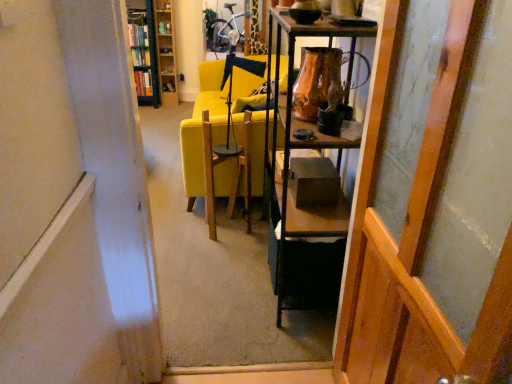
Question: Is the depth of yellow fabric couch at center less than that of wooden chair at center?

Choices:
 (A) yes
 (B) no

Answer: (B)

Question: Is wooden chair at center completely or partially inside yellow fabric couch at center?

Choices:
 (A) yes
 (B) no

Answer: (B)

Question: Could you tell me if yellow fabric couch at center is turned towards wooden chair at center?

Choices:
 (A) no
 (B) yes

Answer: (A)

Question: Can you confirm if yellow fabric couch at center is smaller than wooden chair at center?

Choices:
 (A) no
 (B) yes

Answer: (A)

Question: Does yellow fabric couch at center lie behind wooden chair at center?

Choices:
 (A) no
 (B) yes

Answer: (B)

Question: Is yellow fabric couch at center wider than wooden chair at center?

Choices:
 (A) yes
 (B) no

Answer: (A)

Question: Can you confirm if green metal bookshelf at upper left, which is the 2th cabinetry in right-to-left order, is taller than brown glazed vase at upper center?

Choices:
 (A) no
 (B) yes

Answer: (B)

Question: From a real-world perspective, is green metal bookshelf at upper left, which is the 2th cabinetry in right-to-left order, located higher than brown glazed vase at upper center?

Choices:
 (A) no
 (B) yes

Answer: (A)

Question: Is green metal bookshelf at upper left, which is the 2th cabinetry in right-to-left order, touching brown glazed vase at upper center?

Choices:
 (A) no
 (B) yes

Answer: (A)

Question: Can you confirm if green metal bookshelf at upper left, which is the 2th cabinetry in right-to-left order, is smaller than brown glazed vase at upper center?

Choices:
 (A) no
 (B) yes

Answer: (A)

Question: Is green metal bookshelf at upper left, which is the 2th cabinetry in right-to-left order, at the left side of brown glazed vase at upper center?

Choices:
 (A) yes
 (B) no

Answer: (A)

Question: From the image's perspective, is green metal bookshelf at upper left, marked as the first cabinetry in a left-to-right arrangement, located above brown glazed vase at upper center?

Choices:
 (A) no
 (B) yes

Answer: (B)

Question: From the image's perspective, is wooden bookshelf at upper left, which ranks as the 1th cabinetry in right-to-left order, beneath wooden chair at center?

Choices:
 (A) no
 (B) yes

Answer: (A)